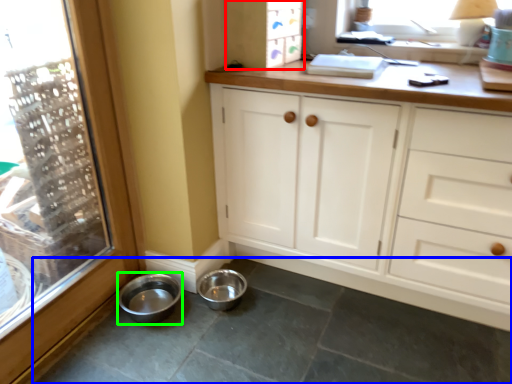
Question: Which is farther away from cabinetry (highlighted by a red box)? concrete (highlighted by a blue box) or basin (highlighted by a green box)?

Choices:
 (A) concrete
 (B) basin

Answer: (A)